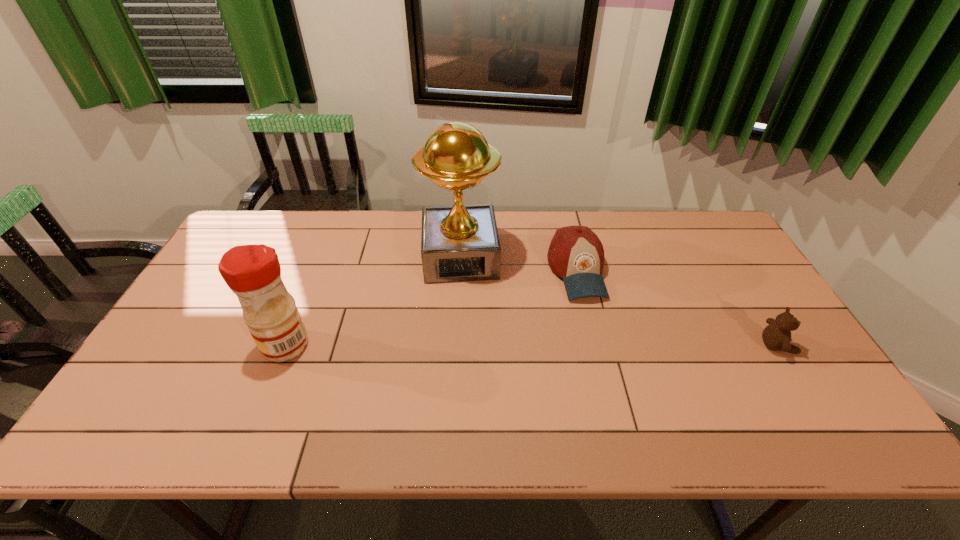
The image size is (960, 540). In order to click on vacant area at the near right corner of the desktop in this screenshot , I will do `click(774, 388)`.

At what (x,y) coordinates should I click in order to perform the action: click on vacant area between the tallest object and the rightmost object. Please return your answer as a coordinate pair (x, y). Looking at the image, I should click on (619, 301).

Where is `free space between the rightmost object and the leftmost object`? Image resolution: width=960 pixels, height=540 pixels. free space between the rightmost object and the leftmost object is located at coordinates (532, 346).

I want to click on free spot between the baseball cap and the second tallest object, so click(x=431, y=308).

The image size is (960, 540). I want to click on free spot between the rightmost object and the leftmost object, so click(532, 346).

Image resolution: width=960 pixels, height=540 pixels. Identify the location of free area in between the award and the third object from left to right. [518, 264].

The width and height of the screenshot is (960, 540). I want to click on empty location between the baseball cap and the third shortest object, so click(431, 308).

Where is `free space between the leftmost object and the baseball cap`? The image size is (960, 540). free space between the leftmost object and the baseball cap is located at coordinates (431, 308).

This screenshot has height=540, width=960. Find the location of `free space that is in between the award and the rightmost object`. free space that is in between the award and the rightmost object is located at coordinates click(x=619, y=301).

Where is `vacant area that lies between the rightmost object and the baseball cap`? vacant area that lies between the rightmost object and the baseball cap is located at coordinates (677, 308).